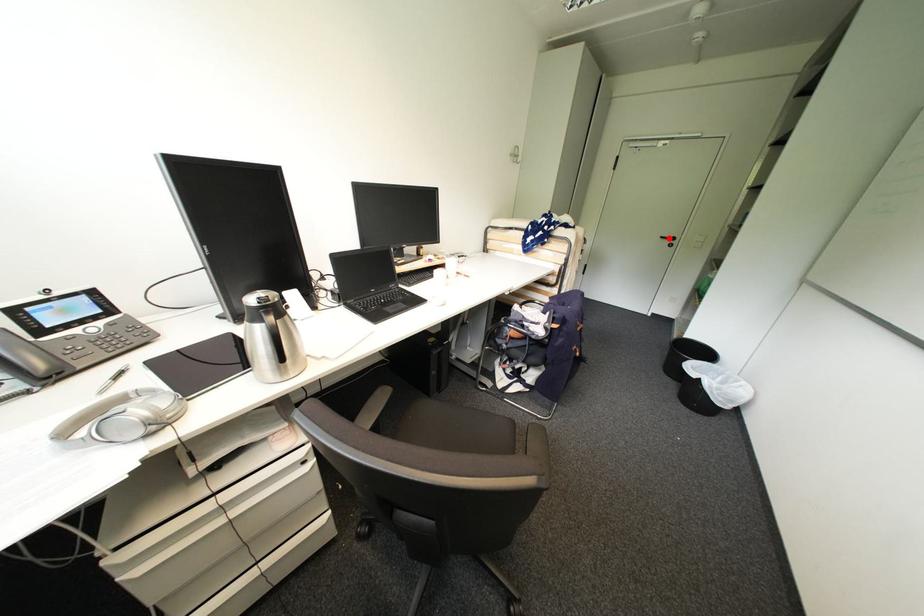
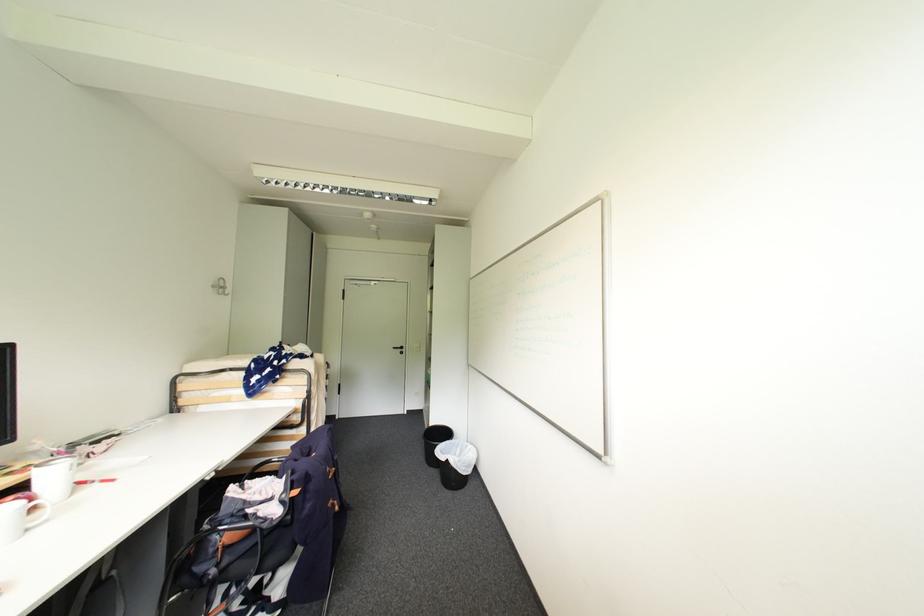
The point at the highlighted location is marked in the first image. Where is the corresponding point in the second image?

(400, 349)